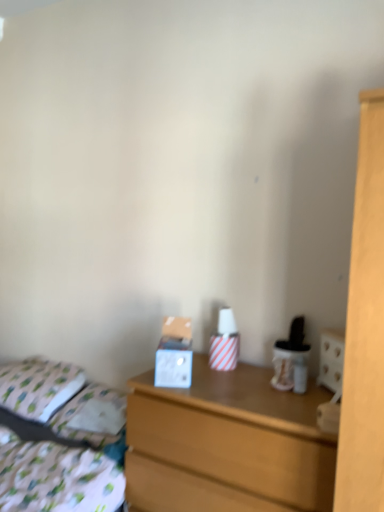
Question: Is wooden chest of drawers at center thinner than white fabric pillow at left?

Choices:
 (A) yes
 (B) no

Answer: (B)

Question: Can you confirm if wooden chest of drawers at center is taller than white fabric pillow at left?

Choices:
 (A) no
 (B) yes

Answer: (B)

Question: Would you say white fabric pillow at left is part of wooden chest of drawers at center's contents?

Choices:
 (A) no
 (B) yes

Answer: (A)

Question: Considering the relative sizes of wooden chest of drawers at center and white fabric pillow at left in the image provided, is wooden chest of drawers at center smaller than white fabric pillow at left?

Choices:
 (A) no
 (B) yes

Answer: (A)

Question: From a real-world perspective, does wooden chest of drawers at center stand above white fabric pillow at left?

Choices:
 (A) no
 (B) yes

Answer: (A)

Question: Considering the relative sizes of wooden chest of drawers at center and white fabric pillow at left in the image provided, is wooden chest of drawers at center bigger than white fabric pillow at left?

Choices:
 (A) yes
 (B) no

Answer: (A)

Question: Does white fabric pillow at left lie behind patterned fabric bed at lower left?

Choices:
 (A) no
 (B) yes

Answer: (B)

Question: Is white fabric pillow at left in contact with patterned fabric bed at lower left?

Choices:
 (A) no
 (B) yes

Answer: (A)

Question: Considering the relative sizes of white fabric pillow at left and patterned fabric bed at lower left in the image provided, is white fabric pillow at left wider than patterned fabric bed at lower left?

Choices:
 (A) yes
 (B) no

Answer: (B)

Question: From the image's perspective, is white fabric pillow at left above patterned fabric bed at lower left?

Choices:
 (A) yes
 (B) no

Answer: (A)

Question: Is white fabric pillow at left positioned with its back to patterned fabric bed at lower left?

Choices:
 (A) no
 (B) yes

Answer: (A)

Question: Considering the relative sizes of white fabric pillow at left and patterned fabric bed at lower left in the image provided, is white fabric pillow at left smaller than patterned fabric bed at lower left?

Choices:
 (A) no
 (B) yes

Answer: (B)

Question: Considering the relative sizes of patterned fabric bed at lower left and white fabric pillow at left in the image provided, is patterned fabric bed at lower left bigger than white fabric pillow at left?

Choices:
 (A) no
 (B) yes

Answer: (B)